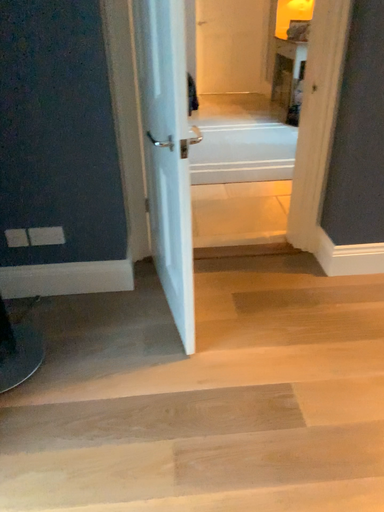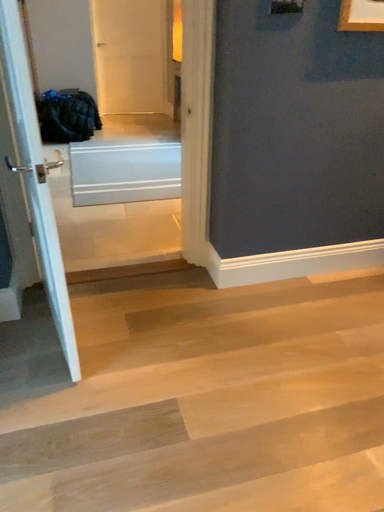
Question: Which way did the camera rotate in the video?

Choices:
 (A) rotated right
 (B) rotated left

Answer: (A)